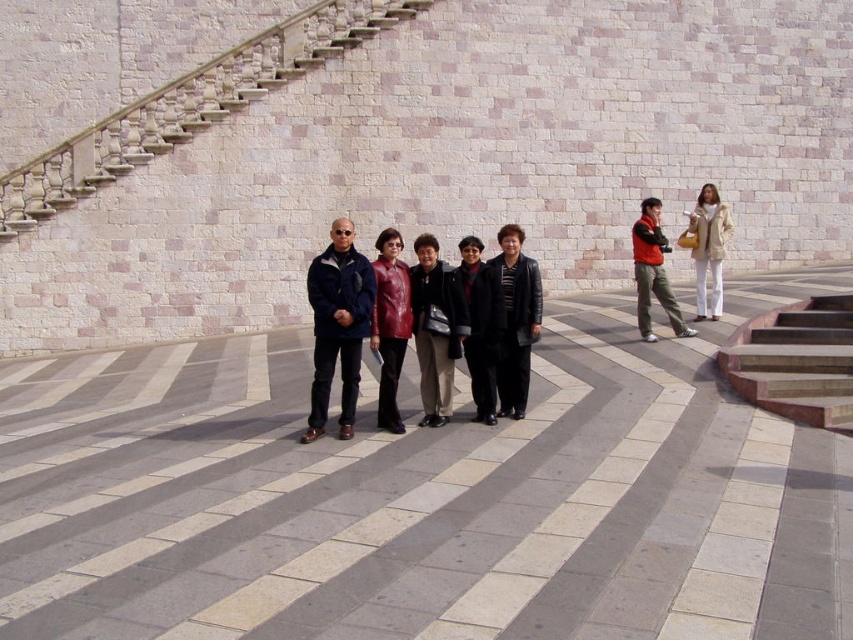
You are trying to decide which jacket to take for a photo shoot. Both the black leather jacket at center and the matte red jacket at center are available. Based on their sizes in the image, which one would you choose if you want the jacket to be more prominent in the photo?

The matte red jacket at center is larger in size compared to the black leather jacket at center, so it would be more prominent in the photo.

You are a photographer trying to adjust the lighting for a group photo. You notice two coats in the scene. Which coat, the black leather jacket at center or the beige leather coat at right, is smaller in size?

The black leather jacket at center is smaller in size compared to the beige leather coat at right.